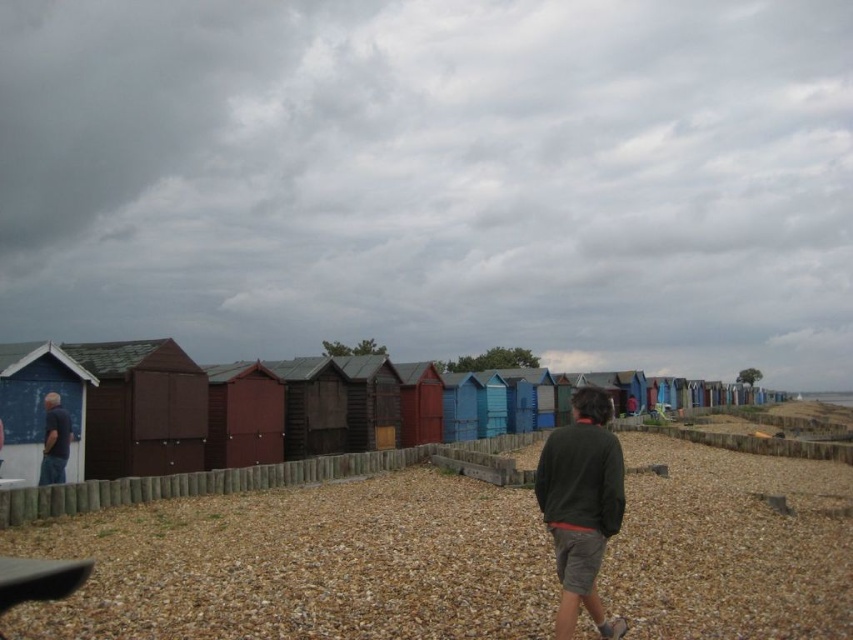
Does brown wooden beach huts at left have a lesser height compared to matte blue shirt at left?

Yes, brown wooden beach huts at left is shorter than matte blue shirt at left.

Who is taller, brown wooden beach huts at left or matte blue shirt at left?

matte blue shirt at left

Locate an element on the screen. The width and height of the screenshot is (853, 640). brown wooden beach huts at left is located at coordinates (305, 564).

Consider the image. Can you confirm if cloudy sky at upper center is thinner than brown wooden beach huts at left?

Incorrect, cloudy sky at upper center's width is not less than brown wooden beach huts at left's.

Does cloudy sky at upper center have a smaller size compared to brown wooden beach huts at left?

Incorrect, cloudy sky at upper center is not smaller in size than brown wooden beach huts at left.

Measure the distance between cloudy sky at upper center and camera.

cloudy sky at upper center and camera are 105.03 meters apart.

What are the coordinates of `cloudy sky at upper center` in the screenshot? It's located at (434, 179).

Between point (230, 500) and point (602, 440), which one is positioned in front?

Positioned in front is point (602, 440).

Can you confirm if brown wooden beach huts at left is positioned to the right of dark green sweater at center?

Yes, brown wooden beach huts at left is to the right of dark green sweater at center.

Find the location of a particular element. This screenshot has height=640, width=853. brown wooden beach huts at left is located at coordinates (305, 564).